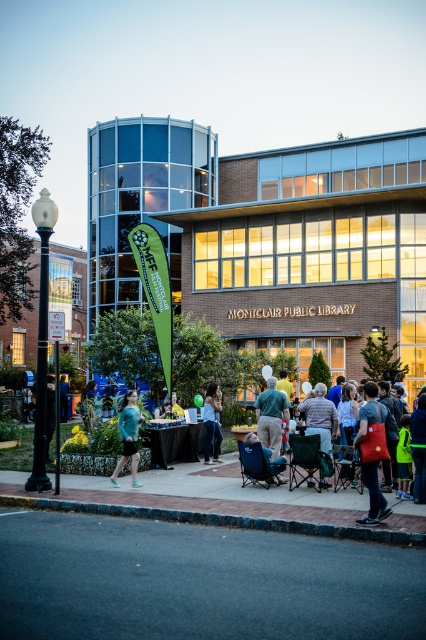
Question: Which point appears closest to the camera in this image?

Choices:
 (A) (178, 451)
 (B) (311, 403)
 (C) (216, 442)

Answer: (B)

Question: Which object appears farthest from the camera in this image?

Choices:
 (A) gray fabric chair at center
 (B) red fabric bag at center
 (C) teal fabric shirt at center
 (D) green fabric shirt at center

Answer: (D)

Question: Is black tablecloth at center smaller than blue fabric chair at center?

Choices:
 (A) no
 (B) yes

Answer: (A)

Question: Which point is farther to the camera?

Choices:
 (A) (330, 403)
 (B) (137, 406)
 (C) (256, 440)
 (D) (270, 433)

Answer: (D)

Question: Where is teal fabric shirt at center located in relation to blue fabric chair at center in the image?

Choices:
 (A) left
 (B) right

Answer: (A)

Question: Does red fabric bag at center have a smaller size compared to teal fabric shirt at center?

Choices:
 (A) yes
 (B) no

Answer: (A)